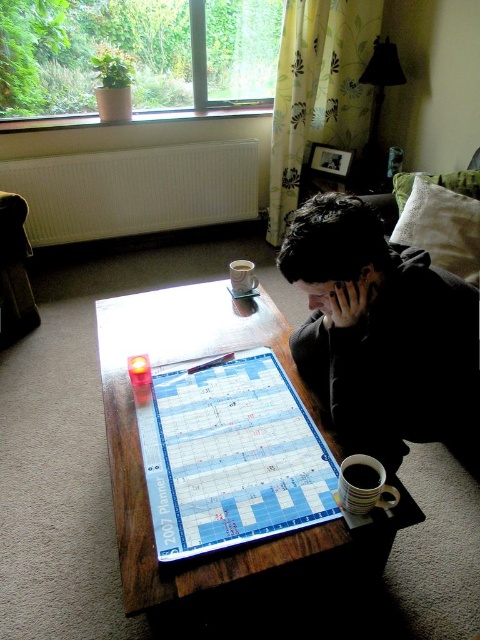
Question: Among these objects, which one is farthest from the camera?

Choices:
 (A) blue plastic planner at center
 (B) wooden table at center

Answer: (A)

Question: Which point is closer to the camera taking this photo?

Choices:
 (A) (205, 572)
 (B) (257, 472)

Answer: (A)

Question: Can you confirm if blue plastic planner at center is smaller than wooden table at center?

Choices:
 (A) yes
 (B) no

Answer: (A)

Question: From the image, what is the correct spatial relationship of black hoodie at lower right in relation to blue plastic planner at center?

Choices:
 (A) right
 (B) left

Answer: (A)

Question: Is black hoodie at lower right thinner than blue plastic planner at center?

Choices:
 (A) no
 (B) yes

Answer: (A)

Question: Which of the following is the farthest from the observer?

Choices:
 (A) (183, 285)
 (B) (238, 493)
 (C) (326, 285)

Answer: (A)